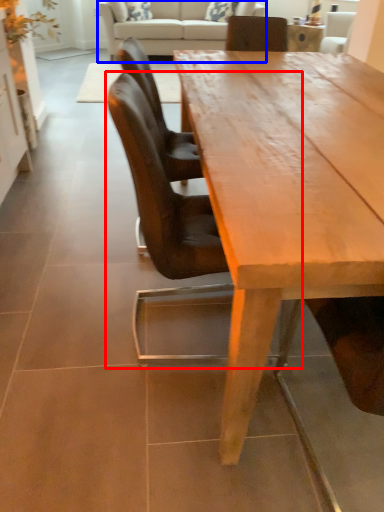
Question: Which object is further to the camera taking this photo, chair (highlighted by a red box) or studio couch (highlighted by a blue box)?

Choices:
 (A) chair
 (B) studio couch

Answer: (B)